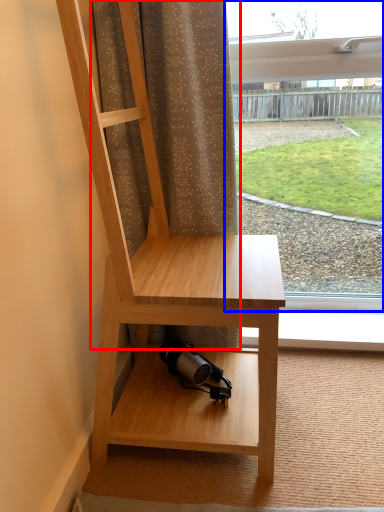
Question: Which object appears closest to the camera in this image, curtain (highlighted by a red box) or window (highlighted by a blue box)?

Choices:
 (A) curtain
 (B) window

Answer: (A)